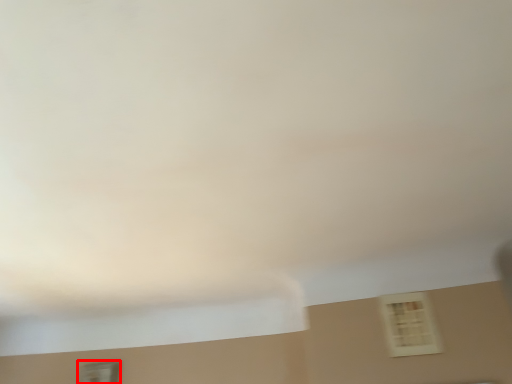
Question: From the image's perspective, what is the correct spatial positioning of window (annotated by the red box) in reference to window?

Choices:
 (A) above
 (B) below

Answer: (B)